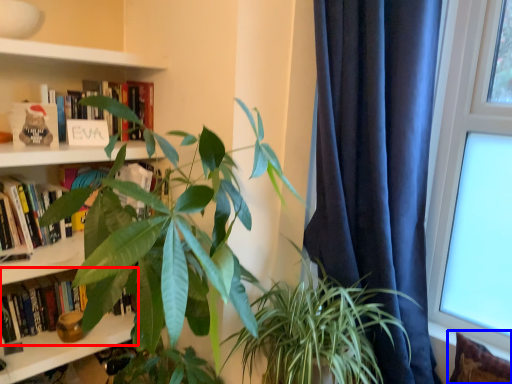
Question: Which point is closer to the camera, book (highlighted by a red box) or pillow (highlighted by a blue box)?

Choices:
 (A) book
 (B) pillow

Answer: (B)